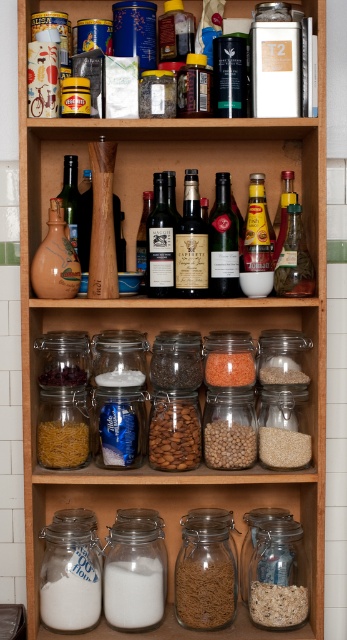
Who is positioned more to the left, clear glass jar at lower right or clear glass jar at center?

clear glass jar at center

The image size is (347, 640). What are the coordinates of `clear glass jar at lower right` in the screenshot? It's located at (277, 577).

Which is behind, point (255, 620) or point (246, 560)?

Point (246, 560)

Find the location of `clear glass jar at lower right`. clear glass jar at lower right is located at coordinates (277, 577).

Who is shorter, golden matte pasta at center or clear glass jar at center?

With less height is golden matte pasta at center.

Does golden matte pasta at center have a lesser width compared to clear glass jar at center?

Yes.

Image resolution: width=347 pixels, height=640 pixels. Identify the location of golden matte pasta at center. (63, 444).

Image resolution: width=347 pixels, height=640 pixels. I want to click on golden matte pasta at center, so click(63, 444).

The height and width of the screenshot is (640, 347). What do you see at coordinates (277, 577) in the screenshot?
I see `clear glass jar at lower right` at bounding box center [277, 577].

Can you confirm if clear glass jar at lower right is positioned to the left of white matte cereal at lower center?

Indeed, clear glass jar at lower right is positioned on the left side of white matte cereal at lower center.

Between point (259, 604) and point (268, 449), which one is positioned in front?

Positioned in front is point (259, 604).

The height and width of the screenshot is (640, 347). Identify the location of clear glass jar at lower right. (277, 577).